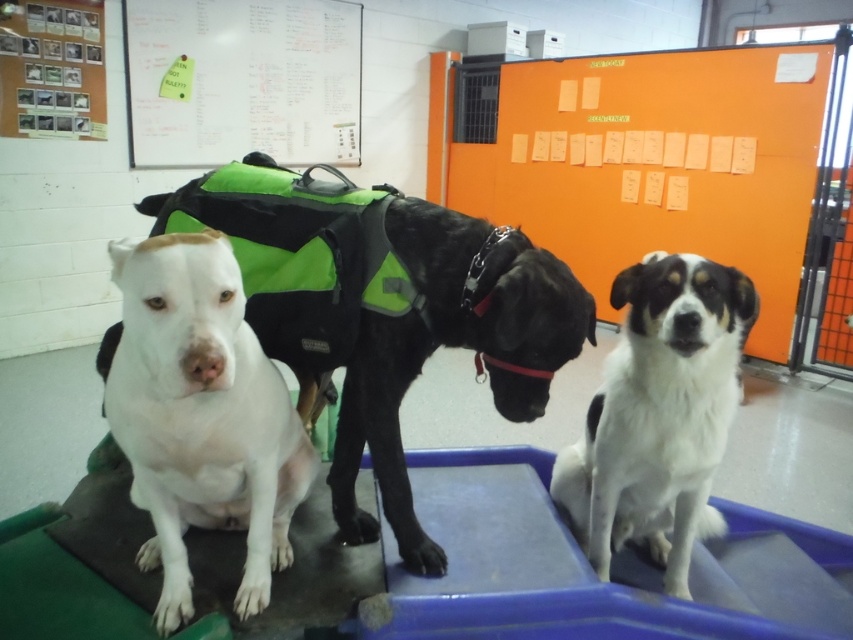
You are a groomer who needs to move the white fur dog at center to the right side of the white fur dog at left. Is this possible given their current positions?

The white fur dog at left is already to the left of the white fur dog at center, so moving the white fur dog at center to the right side of the white fur dog at left would place them in the same order as their current positions. Therefore, the request is possible by keeping them in their current arrangement.

You are a groomer who needs to ensure all dogs are properly sized for their grooming equipment. The white matte dog at left and the white fur dog at left are both on the grooming table. Which dog requires a larger grooming table size due to its size?

The white matte dog at left requires a larger grooming table size because it has a larger size compared to the white fur dog at left.

You are a pet groomer who needs to move a 12 inch wide grooming tool between the white matte dog at left and the white fur dog at center. Can the tool fit between them without touching either dog?

The white matte dog at left and white fur dog at center are 18.70 inches apart from each other. Since the tool is 12 inches wide, there is enough space between them for the tool to fit without touching either dog.